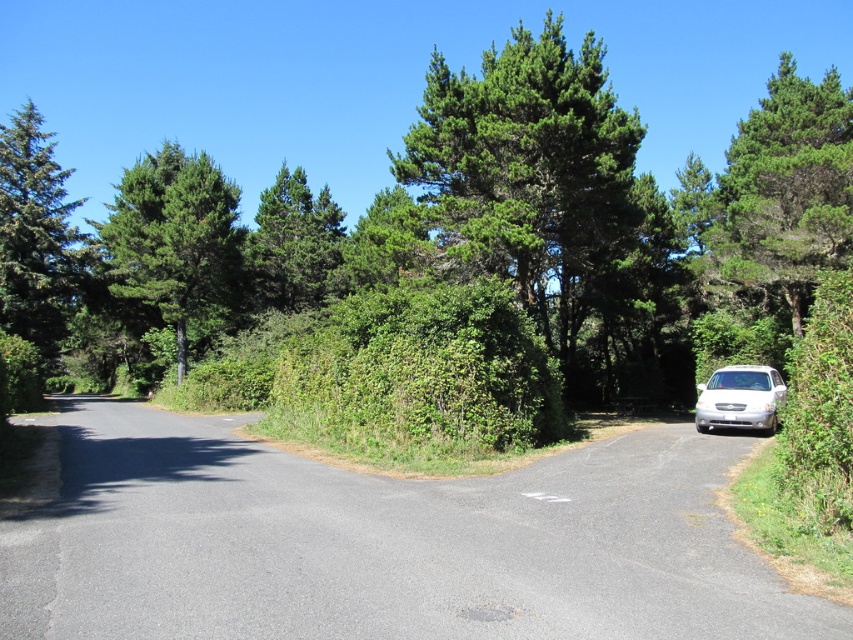
Question: Is asphalt at center positioned at the back of white glossy sedan at right?

Choices:
 (A) no
 (B) yes

Answer: (A)

Question: Which point is farther to the camera?

Choices:
 (A) (187, 557)
 (B) (175, 339)

Answer: (B)

Question: Is green leafy tree at center to the right of green leafy tree at left from the viewer's perspective?

Choices:
 (A) yes
 (B) no

Answer: (A)

Question: Is green leafy tree at left further to the viewer compared to green leafy tree at upper center?

Choices:
 (A) yes
 (B) no

Answer: (B)

Question: Which of the following is the farthest from the observer?

Choices:
 (A) green leafy tree at center
 (B) white glossy sedan at right

Answer: (A)

Question: Among these objects, which one is farthest from the camera?

Choices:
 (A) green needle-like at left
 (B) white glossy sedan at right

Answer: (A)